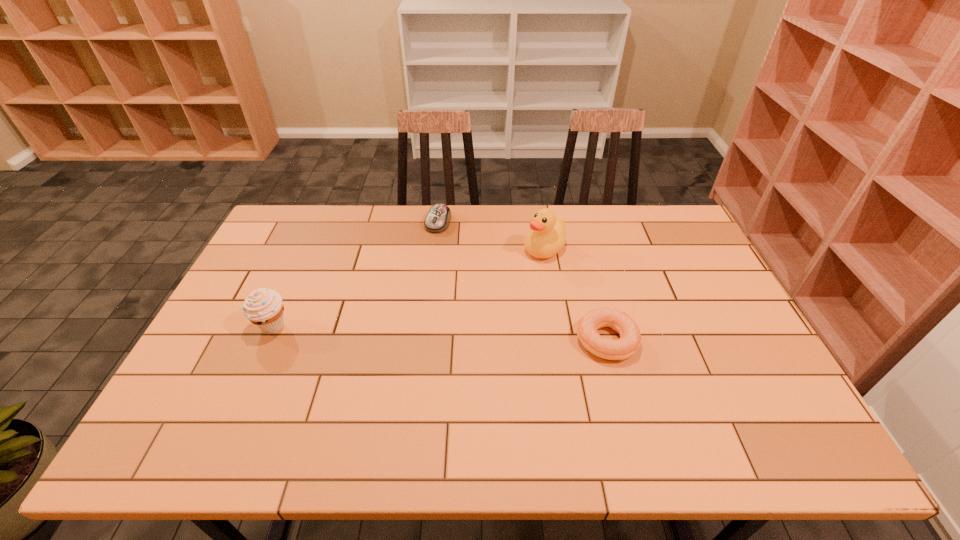
Where is `vacant space positioned at the beak of the tallest object`? This screenshot has width=960, height=540. vacant space positioned at the beak of the tallest object is located at coordinates (452, 306).

This screenshot has width=960, height=540. Find the location of `vacant space located at the beak of the tallest object`. vacant space located at the beak of the tallest object is located at coordinates (463, 300).

Where is `free space located on the wheel side of the third object from right to left`? Image resolution: width=960 pixels, height=540 pixels. free space located on the wheel side of the third object from right to left is located at coordinates (420, 266).

Image resolution: width=960 pixels, height=540 pixels. I want to click on vacant area situated on the wheel side of the third object from right to left, so click(x=398, y=313).

This screenshot has height=540, width=960. Find the location of `vacant space positioned 0.070m on the wheel side of the third object from right to left`. vacant space positioned 0.070m on the wheel side of the third object from right to left is located at coordinates (428, 246).

You are a GUI agent. You are given a task and a screenshot of the screen. Output one action in this format:
    pyautogui.click(x=<x>, y=<y>)
    Task: Click on the duck located in the far edge section of the desktop
    
    Given the screenshot: What is the action you would take?
    pyautogui.click(x=547, y=237)

Image resolution: width=960 pixels, height=540 pixels. In order to click on computer mouse present at the far edge in this screenshot , I will do `click(437, 220)`.

The image size is (960, 540). I want to click on object that is at the left edge, so click(263, 307).

This screenshot has width=960, height=540. I want to click on free space at the far edge of the desktop, so click(364, 211).

Where is `free location at the near edge of the desktop`? The height and width of the screenshot is (540, 960). free location at the near edge of the desktop is located at coordinates (362, 410).